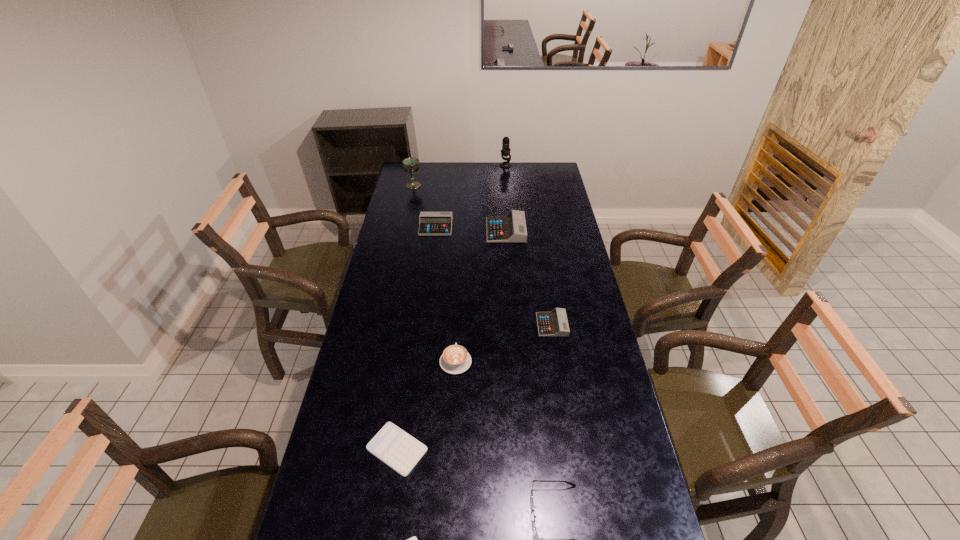
Identify the location of the third tallest calculator. (550, 324).

Locate an element on the screen. The height and width of the screenshot is (540, 960). the fourth tallest calculator is located at coordinates (399, 450).

This screenshot has width=960, height=540. What are the coordinates of `the second nearest calculator` in the screenshot? It's located at (399, 450).

Identify the location of free point located 0.350m on the left of the tallest object. (440, 166).

I want to click on free spot located 0.160m on the back of the chalice, so click(418, 167).

Identify the location of free location located 0.380m on the back of the biggest gray calculator. The image size is (960, 540). click(502, 180).

The height and width of the screenshot is (540, 960). Identify the location of blank area located 0.090m on the back of the second smallest gray calculator. [439, 208].

The width and height of the screenshot is (960, 540). Identify the location of blank space located 0.230m on the side of the cappuccino with the handle. (459, 302).

This screenshot has width=960, height=540. I want to click on free space located 0.400m on the side of the cappuccino with the handle, so pos(460,274).

Where is `vacant position located 0.310m on the side of the cappuccino with the handle`? This screenshot has height=540, width=960. vacant position located 0.310m on the side of the cappuccino with the handle is located at coordinates (459, 288).